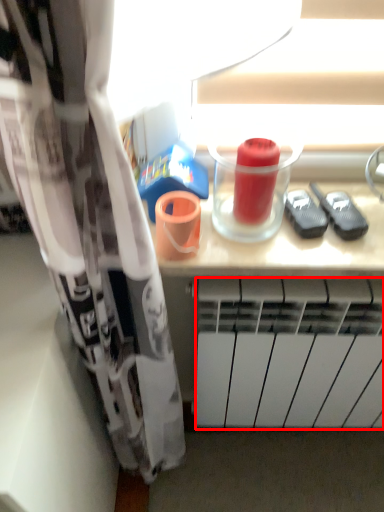
Question: Observing the image, what is the correct spatial positioning of radiator (annotated by the red box) in reference to beverage?

Choices:
 (A) right
 (B) left

Answer: (A)